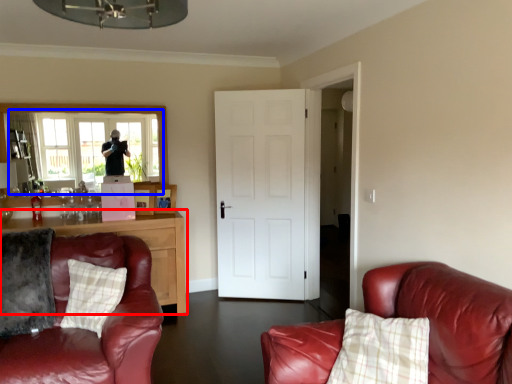
Question: Which of the following is the farthest to the observer, cabinetry (highlighted by a red box) or window (highlighted by a blue box)?

Choices:
 (A) cabinetry
 (B) window

Answer: (B)